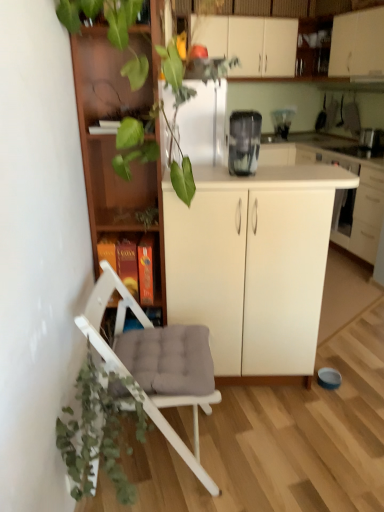
Question: From a real-world perspective, is white glossy cabinet at upper right, which is the third cabinetry in bottom-to-top order, positioned over transparent plastic blender at upper center, the third appliance when ordered from front to back, based on gravity?

Choices:
 (A) yes
 (B) no

Answer: (A)

Question: Does white glossy cabinet at upper right, arranged as the second cabinetry when viewed from the left, appear on the right side of transparent plastic blender at upper center, the third appliance when ordered from front to back?

Choices:
 (A) yes
 (B) no

Answer: (A)

Question: Is white glossy cabinet at upper right, arranged as the second cabinetry when viewed from the left, turned away from transparent plastic blender at upper center, positioned as the 3th appliance in bottom-to-top order?

Choices:
 (A) no
 (B) yes

Answer: (A)

Question: From the image's perspective, is white glossy cabinet at upper right, which is the 1th cabinetry in top-to-bottom order, over transparent plastic blender at upper center, the third appliance when ordered from front to back?

Choices:
 (A) no
 (B) yes

Answer: (B)

Question: Is white glossy cabinet at upper right, which is the 1th cabinetry in top-to-bottom order, beside transparent plastic blender at upper center, positioned as the 3th appliance in bottom-to-top order?

Choices:
 (A) no
 (B) yes

Answer: (A)

Question: Is transparent plastic blender at center, which is the third appliance from back to front, bigger or smaller than green matte plant at lower left?

Choices:
 (A) small
 (B) big

Answer: (A)

Question: Is point (251, 125) closer or farther from the camera than point (72, 480)?

Choices:
 (A) closer
 (B) farther

Answer: (B)

Question: Considering the positions of transparent plastic blender at center, the first appliance ordered from the bottom, and green matte plant at lower left in the image, is transparent plastic blender at center, the first appliance ordered from the bottom, taller or shorter than green matte plant at lower left?

Choices:
 (A) short
 (B) tall

Answer: (A)

Question: From the image's perspective, is transparent plastic blender at center, which is counted as the third appliance, starting from the top, above or below green matte plant at lower left?

Choices:
 (A) below
 (B) above

Answer: (B)

Question: In terms of height, does green matte plant at lower left look taller or shorter compared to transparent plastic blender at upper center, which appears as the 2th appliance when viewed from the right?

Choices:
 (A) tall
 (B) short

Answer: (A)

Question: In terms of width, does green matte plant at lower left look wider or thinner when compared to transparent plastic blender at upper center, placed as the first appliance when sorted from back to front?

Choices:
 (A) wide
 (B) thin

Answer: (A)

Question: In terms of size, does green matte plant at lower left appear bigger or smaller than transparent plastic blender at upper center, which appears as the 2th appliance when viewed from the left?

Choices:
 (A) big
 (B) small

Answer: (A)

Question: From a real-world perspective, is green matte plant at lower left physically located above or below transparent plastic blender at upper center, placed as the first appliance when sorted from back to front?

Choices:
 (A) below
 (B) above

Answer: (A)

Question: In the image, is white padded chair at lower left positioned in front of or behind metallic silver toaster at upper right, placed as the 3th appliance when sorted from left to right?

Choices:
 (A) behind
 (B) front

Answer: (B)

Question: Is white padded chair at lower left inside the boundaries of metallic silver toaster at upper right, acting as the 2th appliance starting from the top, or outside?

Choices:
 (A) outside
 (B) inside

Answer: (A)